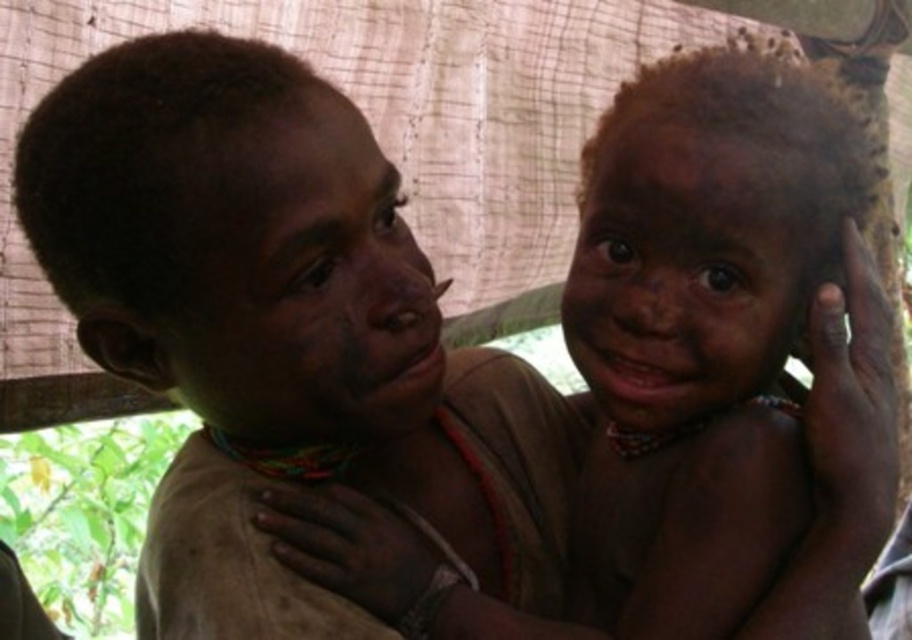
You are a photographer trying to capture a portrait of the two children in the scene. You notice that the dark skin textured face at center and the dark skin face at center have different sizes in the frame. Which child should you adjust your camera settings for to ensure proper exposure, and why?

You should adjust your camera settings for the dark skin textured face at center because its width is larger than the dark skin face at center, meaning it occupies more space in the frame and may require different exposure adjustments to capture details properly.

Looking at the scene described, which of the two faces, the dark skin textured face at center or the dark skin face at center, is positioned to the left?

The dark skin textured face at center is positioned to the left of the dark skin face at center.

You are a photographer trying to adjust the lighting for a portrait. You have a reflector that you can place at point 0.455, 0.340. Where should you position it relative to the dark skin textured face at center to effectively bounce light onto it?

The reflector should be positioned at point (309, 291), which is directly at the location of the dark skin textured face at center, to effectively bounce light onto it.